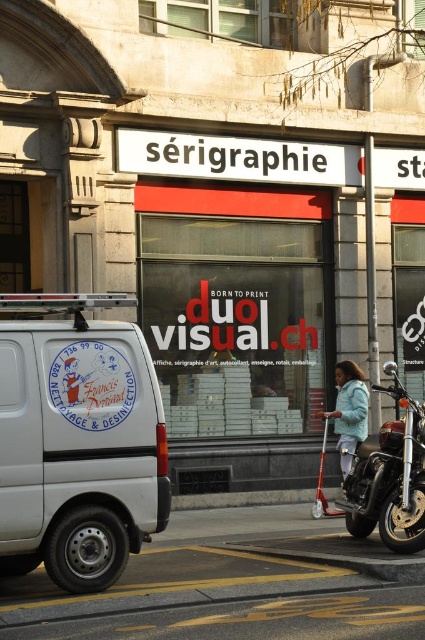
Who is positioned more to the right, white matte van at left or shiny chrome motorcycle at right?

Positioned to the right is shiny chrome motorcycle at right.

Can you confirm if white matte van at left is wider than shiny chrome motorcycle at right?

Correct, the width of white matte van at left exceeds that of shiny chrome motorcycle at right.

Is point (34, 365) positioned behind point (410, 428)?

No, (34, 365) is closer to viewer.

Locate an element on the screen. The width and height of the screenshot is (425, 640). white matte van at left is located at coordinates (78, 442).

Which is in front, point (51, 348) or point (342, 451)?

Point (51, 348) is in front.

Locate an element on the screen. The width and height of the screenshot is (425, 640). white matte van at left is located at coordinates (78, 442).

Locate an element on the screen. white matte van at left is located at coordinates (78, 442).

Who is more distant from viewer, (x=413, y=502) or (x=354, y=435)?

Point (x=354, y=435)

Between shiny chrome motorcycle at right and light blue fabric jacket at center, which one has more height?

shiny chrome motorcycle at right

I want to click on shiny chrome motorcycle at right, so click(390, 476).